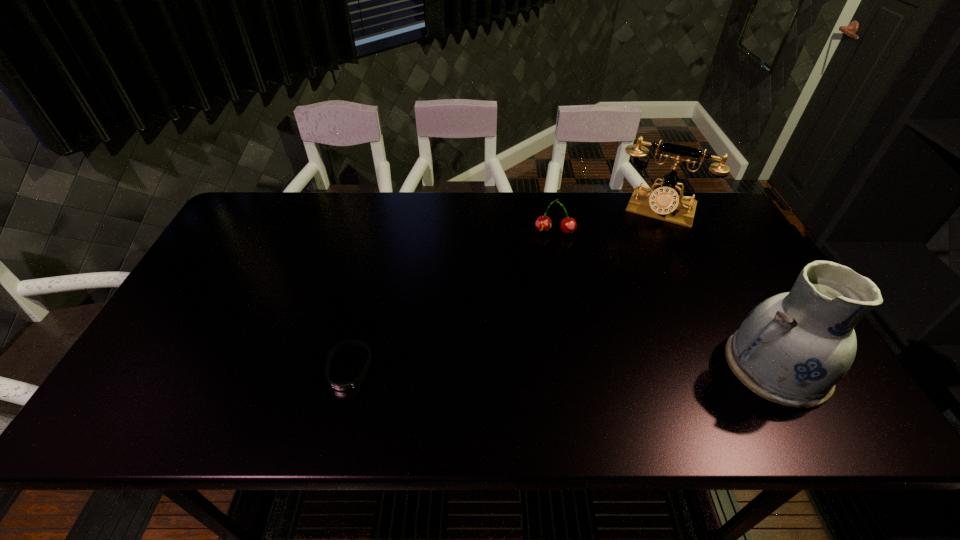
This screenshot has width=960, height=540. I want to click on vacant area that lies between the second tallest object and the cherry, so click(607, 220).

The height and width of the screenshot is (540, 960). In order to click on free area in between the second object from left to right and the pottery in this screenshot , I will do `click(665, 299)`.

The height and width of the screenshot is (540, 960). I want to click on free space between the second tallest object and the pottery, so click(x=717, y=288).

Identify the location of empty space that is in between the telephone and the third object from right to left. (607, 220).

You are a GUI agent. You are given a task and a screenshot of the screen. Output one action in this format:
    pyautogui.click(x=<x>, y=<y>)
    Task: Click on the free space between the second shortest object and the telephone
    
    Given the screenshot: What is the action you would take?
    pyautogui.click(x=607, y=220)

Where is `the second closest object relative to the wristband`? This screenshot has width=960, height=540. the second closest object relative to the wristband is located at coordinates (793, 348).

Image resolution: width=960 pixels, height=540 pixels. In order to click on object that is the third closest to the cherry in this screenshot , I will do `click(341, 386)`.